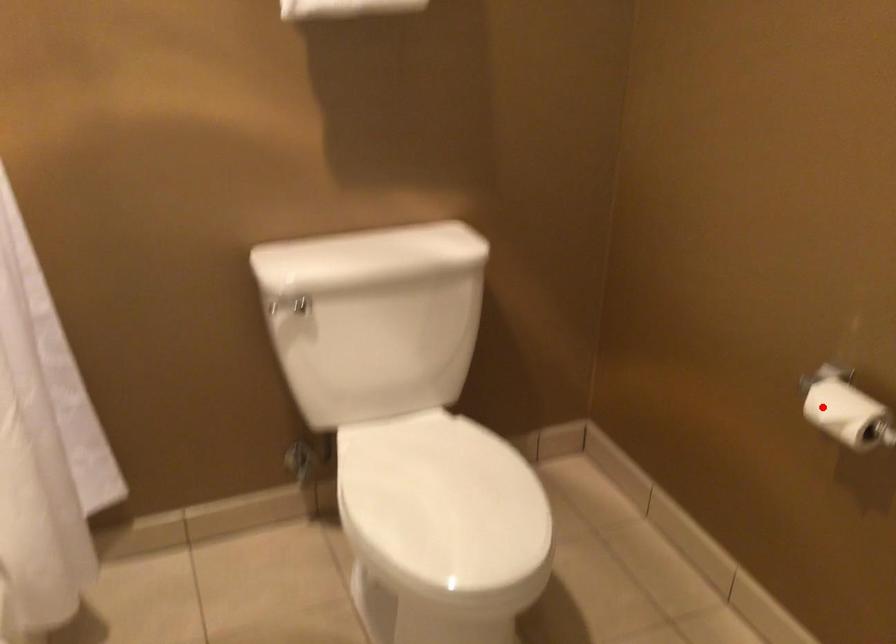
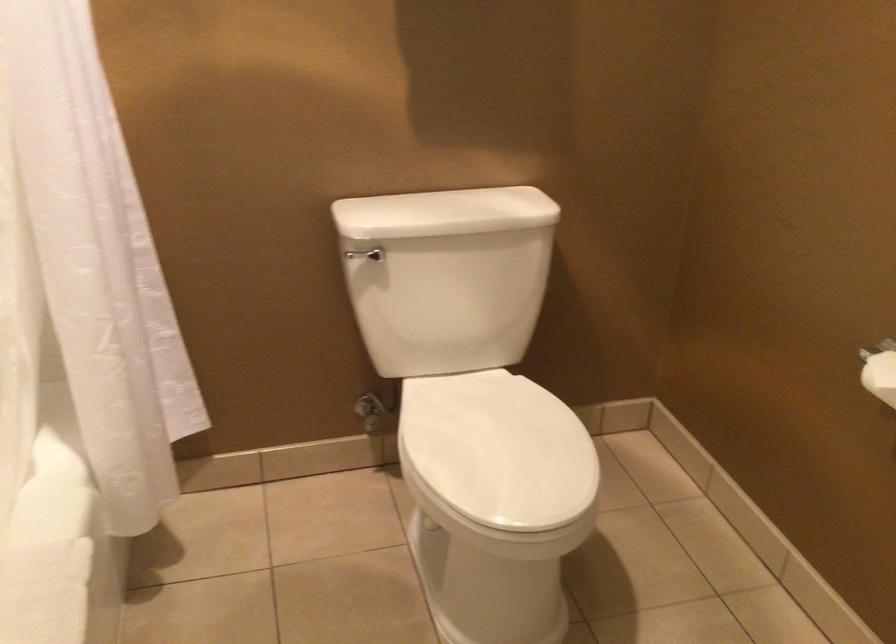
Find the pixel in the second image that matches the highlighted location in the first image.

(880, 375)